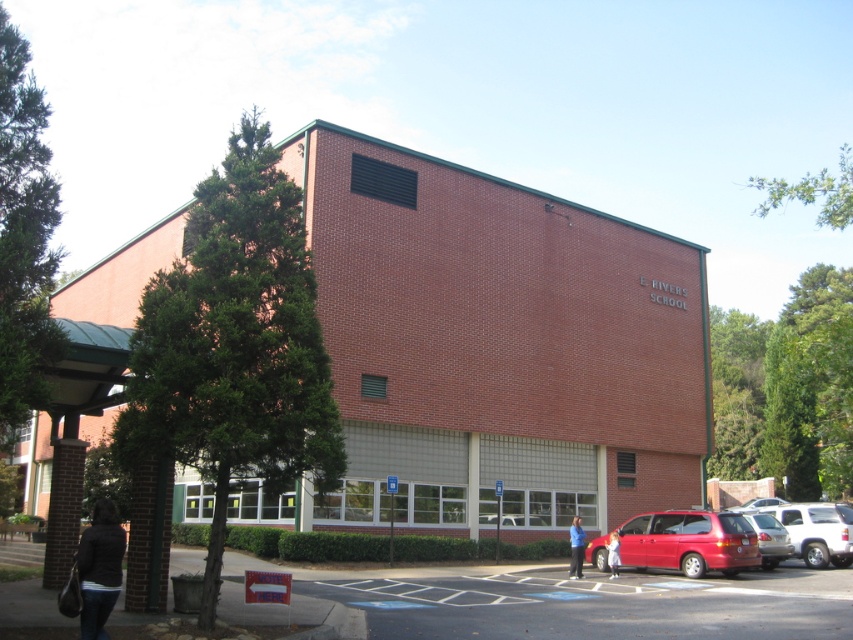
Question: Does matte red van at center appear on the right side of light brown hair at center?

Choices:
 (A) no
 (B) yes

Answer: (B)

Question: Estimate the real-world distances between objects in this image. Which object is farther from the light brown hair at center?

Choices:
 (A) matte red van at center
 (B) metallic red minivan at center
 (C) blue fabric shirt at center
 (D) silver metallic suv at center right

Answer: (D)

Question: In this image, where is silver metallic suv at center right located relative to matte red van at center?

Choices:
 (A) left
 (B) right

Answer: (B)

Question: Among these objects, which one is farthest from the camera?

Choices:
 (A) matte red van at center
 (B) metallic red minivan at center
 (C) light brown hair at center
 (D) dark gray jacket at lower left

Answer: (B)

Question: Does metallic red minivan at center have a greater width compared to matte red van at center?

Choices:
 (A) yes
 (B) no

Answer: (B)

Question: Which point appears closest to the camera in this image?

Choices:
 (A) (691, 520)
 (B) (610, 576)
 (C) (579, 524)
 (D) (775, 566)

Answer: (A)